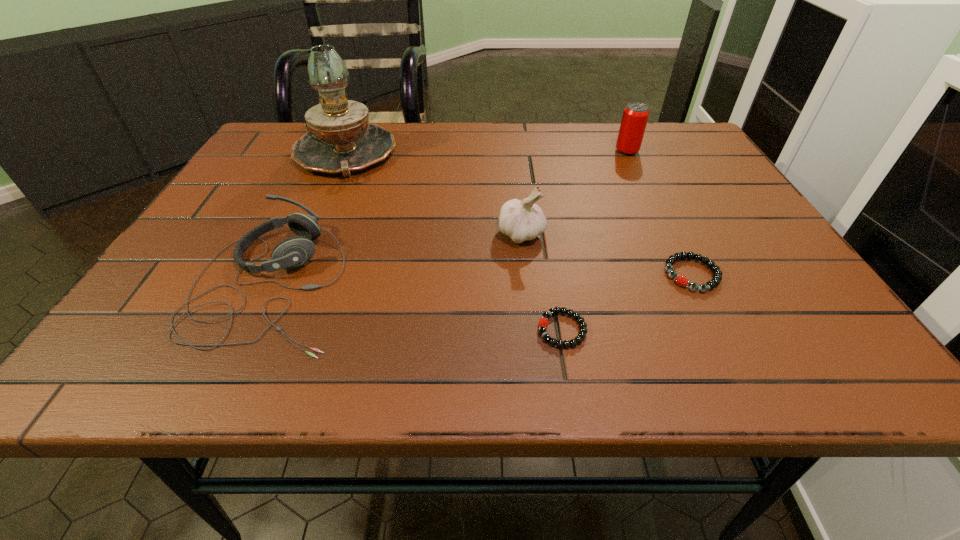
This screenshot has width=960, height=540. Find the location of `object located in the right edge section of the desktop`. object located in the right edge section of the desktop is located at coordinates (682, 281).

The image size is (960, 540). What are the coordinates of `object located in the far left corner section of the desktop` in the screenshot? It's located at point(341,141).

Image resolution: width=960 pixels, height=540 pixels. In order to click on object that is at the near left corner in this screenshot , I will do `click(292, 252)`.

Find the location of a particular element. The width and height of the screenshot is (960, 540). blank space at the far edge is located at coordinates point(544,158).

The height and width of the screenshot is (540, 960). Find the location of `vacant area at the near edge of the desktop`. vacant area at the near edge of the desktop is located at coordinates (575, 356).

Locate an element on the screen. free space at the left edge of the desktop is located at coordinates click(162, 327).

You are a GUI agent. You are given a task and a screenshot of the screen. Output one action in this format:
    pyautogui.click(x=<x>, y=<y>)
    Task: Click on the free space at the right edge
    
    Given the screenshot: What is the action you would take?
    pyautogui.click(x=691, y=192)

Image resolution: width=960 pixels, height=540 pixels. In the image, there is a desktop. Find the location of `vacant space at the far right corner`. vacant space at the far right corner is located at coordinates (648, 149).

This screenshot has height=540, width=960. What are the coordinates of `empty location between the headset and the can` in the screenshot? It's located at (448, 217).

At what (x,y) coordinates should I click in order to perform the action: click on free space between the garlic and the headset. Please return your answer as a coordinate pair (x, y). Looking at the image, I should click on (396, 259).